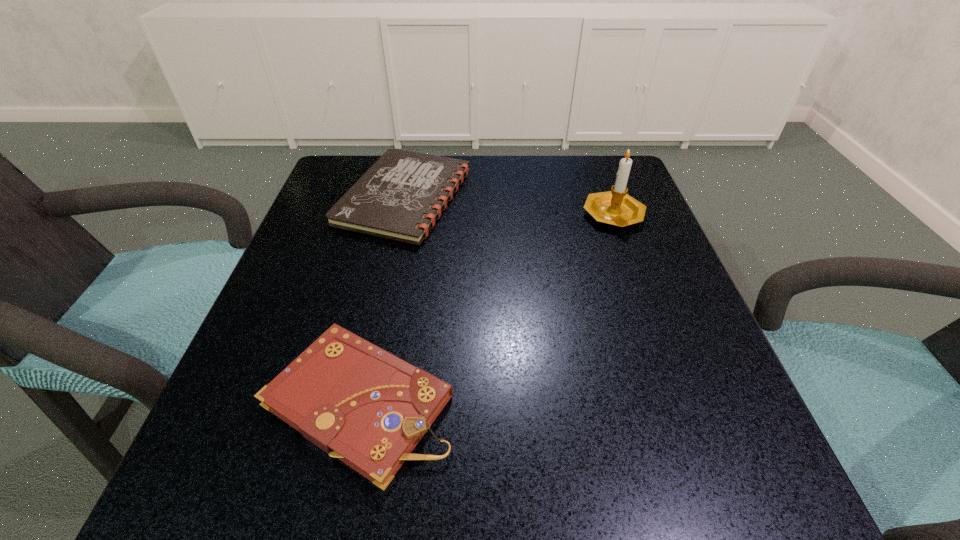
Locate an element on the screen. The height and width of the screenshot is (540, 960). candle holder is located at coordinates (615, 207).

Identify the location of the rightmost object. The height and width of the screenshot is (540, 960). (615, 207).

Find the location of `the nearer notebook`. the nearer notebook is located at coordinates 357,402.

Locate an element on the screen. the farther notebook is located at coordinates (400, 197).

This screenshot has height=540, width=960. I want to click on the shortest object, so click(400, 197).

I want to click on free space located 0.150m on the back of the tallest object, so click(593, 160).

Image resolution: width=960 pixels, height=540 pixels. Find the location of `blank area located 0.100m on the back of the nearest object`. blank area located 0.100m on the back of the nearest object is located at coordinates (383, 289).

Locate an element on the screen. vacant area located on the front of the farther notebook is located at coordinates (379, 312).

Locate an element on the screen. Image resolution: width=960 pixels, height=540 pixels. candle holder that is at the far edge is located at coordinates (615, 207).

This screenshot has height=540, width=960. What are the coordinates of `notebook at the far edge` in the screenshot? It's located at (400, 197).